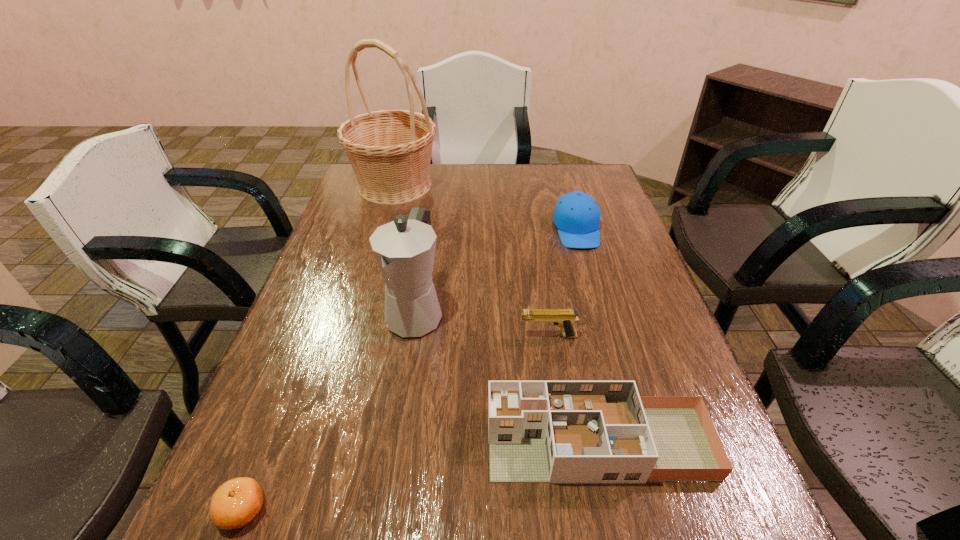
At what (x,y) coordinates should I click in order to perform the action: click on vacant region at the far left corner of the desktop. Please return your answer as a coordinate pair (x, y). This screenshot has height=540, width=960. Looking at the image, I should click on (352, 195).

At what (x,y) coordinates should I click in order to perform the action: click on free space at the far right corner of the desktop. Please return your answer as a coordinate pair (x, y). Image resolution: width=960 pixels, height=540 pixels. Looking at the image, I should click on (583, 192).

The height and width of the screenshot is (540, 960). Find the location of `empty space that is in between the tallest object and the cap`. empty space that is in between the tallest object and the cap is located at coordinates (486, 207).

Where is `empty location between the second nearest object and the clementine`? This screenshot has width=960, height=540. empty location between the second nearest object and the clementine is located at coordinates (420, 477).

Where is `free space between the pistol and the second farthest object`? The image size is (960, 540). free space between the pistol and the second farthest object is located at coordinates (563, 283).

Where is `free space between the pistol and the second farthest object`? The height and width of the screenshot is (540, 960). free space between the pistol and the second farthest object is located at coordinates (563, 283).

In order to click on vacant area that lies between the pistol and the basket in this screenshot , I will do `click(471, 261)`.

Find the location of a particular element. This screenshot has width=960, height=540. free space that is in between the second nearest object and the second tallest object is located at coordinates (507, 379).

You are a GUI agent. You are given a task and a screenshot of the screen. Output one action in this format:
    pyautogui.click(x=<x>, y=<y>)
    Task: Click on the free space between the fifth shortest object and the fifth farthest object
    
    Given the screenshot: What is the action you would take?
    pyautogui.click(x=507, y=379)

The width and height of the screenshot is (960, 540). In order to click on empty space between the clementine and the coffeepot in this screenshot , I will do pyautogui.click(x=329, y=413).